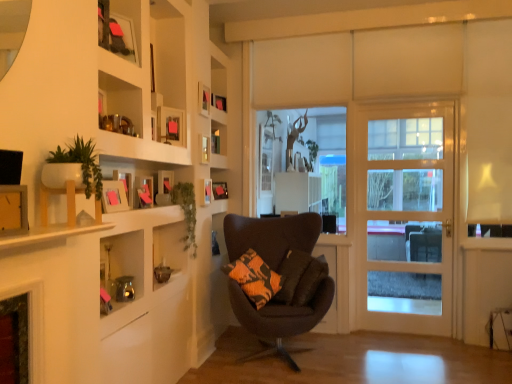
Question: Can you confirm if matte wooden picture frame at upper center, the 6th picture frame viewed from the back, is positioned to the right of matte black picture frame at upper center, acting as the 2th picture frame starting from the back?

Choices:
 (A) no
 (B) yes

Answer: (A)

Question: Is there a large distance between matte wooden picture frame at upper center, the 6th picture frame viewed from the back, and matte black picture frame at upper center, acting as the 2th picture frame starting from the back?

Choices:
 (A) no
 (B) yes

Answer: (A)

Question: Considering the relative sizes of matte wooden picture frame at upper center, the 6th picture frame viewed from the back, and matte black picture frame at upper center, acting as the 2th picture frame starting from the back, in the image provided, is matte wooden picture frame at upper center, the 6th picture frame viewed from the back, thinner than matte black picture frame at upper center, acting as the 2th picture frame starting from the back,?

Choices:
 (A) yes
 (B) no

Answer: (B)

Question: Is matte wooden picture frame at upper center, acting as the 3th picture frame starting from the front, at the left side of matte black picture frame at upper center, placed as the 7th picture frame when sorted from front to back?

Choices:
 (A) yes
 (B) no

Answer: (A)

Question: From a real-world perspective, does matte wooden picture frame at upper center, the 6th picture frame viewed from the back, sit lower than matte black picture frame at upper center, acting as the 2th picture frame starting from the back?

Choices:
 (A) yes
 (B) no

Answer: (A)

Question: Considering the positions of point (205, 86) and point (120, 62), is point (205, 86) closer or farther from the camera than point (120, 62)?

Choices:
 (A) closer
 (B) farther

Answer: (B)

Question: From a real-world perspective, is matte wooden picture frame at upper center, which appears as the 4th picture frame when viewed from the back, above or below wooden shelves at upper left?

Choices:
 (A) below
 (B) above

Answer: (A)

Question: Based on their positions, is matte wooden picture frame at upper center, the fifth picture frame from the front, located to the left or right of wooden shelves at upper left?

Choices:
 (A) right
 (B) left

Answer: (A)

Question: Considering the positions of matte wooden picture frame at upper center, the fifth picture frame from the front, and wooden shelves at upper left in the image, is matte wooden picture frame at upper center, the fifth picture frame from the front, bigger or smaller than wooden shelves at upper left?

Choices:
 (A) small
 (B) big

Answer: (A)

Question: Is matte pink picture frame at upper left, arranged as the second picture frame when viewed from the front, to the left or to the right of matte wooden picture frame at upper center, acting as the 3th picture frame starting from the front, in the image?

Choices:
 (A) right
 (B) left

Answer: (B)

Question: From their relative heights in the image, would you say matte pink picture frame at upper left, arranged as the second picture frame when viewed from the front, is taller or shorter than matte wooden picture frame at upper center, acting as the 3th picture frame starting from the front?

Choices:
 (A) tall
 (B) short

Answer: (B)

Question: From a real-world perspective, relative to matte wooden picture frame at upper center, acting as the 3th picture frame starting from the front, is matte pink picture frame at upper left, which is the seventh picture frame in back-to-front order, vertically above or below?

Choices:
 (A) above
 (B) below

Answer: (B)

Question: Is matte pink picture frame at upper left, which is the seventh picture frame in back-to-front order, wider or thinner than matte wooden picture frame at upper center, the 6th picture frame viewed from the back?

Choices:
 (A) thin
 (B) wide

Answer: (B)

Question: From a real-world perspective, is matte pink picture frame at upper left, which is the seventh picture frame in back-to-front order, above or below matte black picture frame at upper center, placed as the 7th picture frame when sorted from front to back?

Choices:
 (A) below
 (B) above

Answer: (A)

Question: In the image, is matte pink picture frame at upper left, which is the seventh picture frame in back-to-front order, positioned in front of or behind matte black picture frame at upper center, placed as the 7th picture frame when sorted from front to back?

Choices:
 (A) front
 (B) behind

Answer: (A)